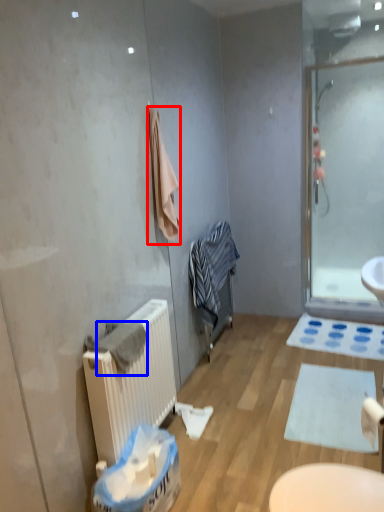
Question: Among these objects, which one is farthest to the camera, bath towel (highlighted by a red box) or bath towel (highlighted by a blue box)?

Choices:
 (A) bath towel
 (B) bath towel

Answer: (A)